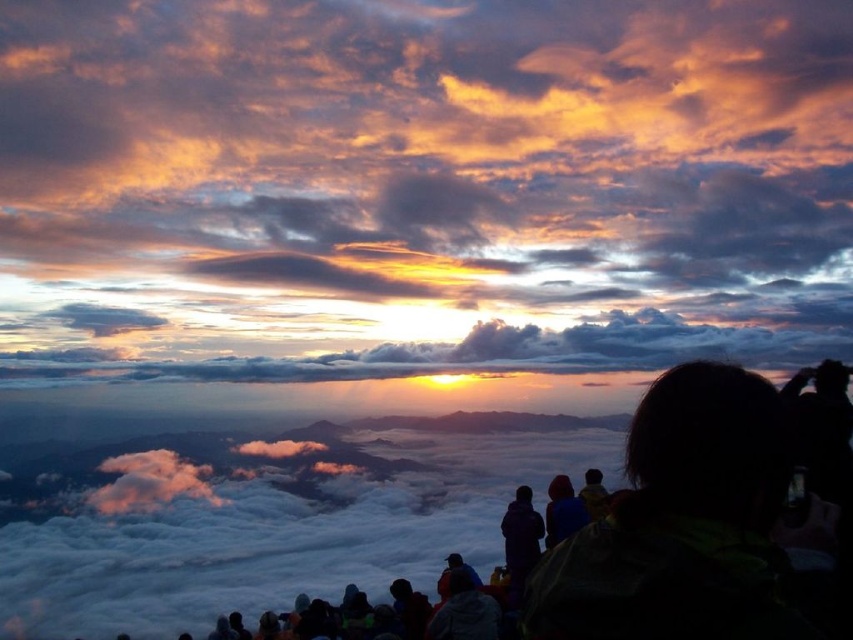
You are standing at the edge of a cliff overlooking the sunset scene. You notice the cloudy sky at upper center and the blue fabric jacket at center. Which object is closer to you?

The cloudy sky at upper center is further away than the blue fabric jacket at center, so the blue fabric jacket at center is closer to you.

You are standing at the point where the image was taken and want to know how far you are from the point labeled as point (6, 33). Can you determine the distance?

The distance between you and point (6, 33) is 2325.50 feet.